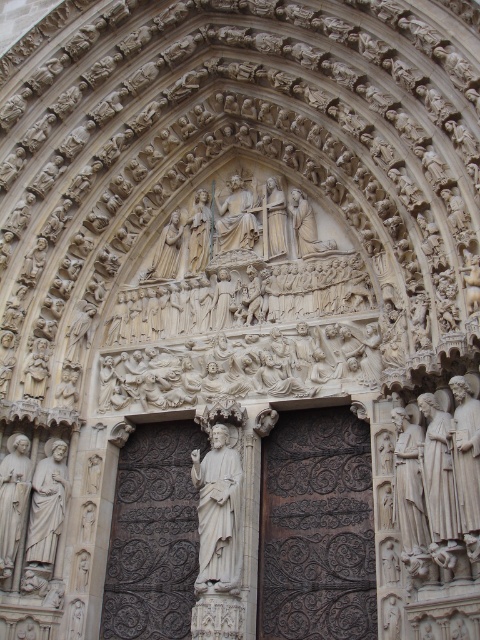
You are an architect planning to install a new decorative element between the dark brown wood at center and the white marble statue at lower left. Which object should the new element be placed closer to in order to maintain symmetry?

The new decorative element should be placed closer to the white marble statue at lower left because the dark brown wood at center is wider, so balancing with the narrower white marble statue at lower left would require positioning closer to the smaller object to achieve symmetry.